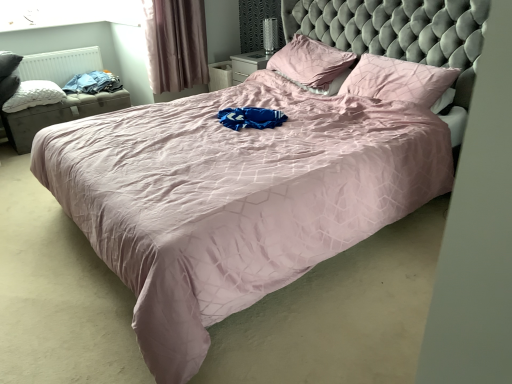
Question: From the image's perspective, is pink fabric pillow at upper right, the first pillow when ordered from right to left, beneath white quilted pillow at left, marked as the first pillow in a left-to-right arrangement?

Choices:
 (A) yes
 (B) no

Answer: (A)

Question: Is pink fabric pillow at upper right, the first pillow when ordered from right to left, aimed at white quilted pillow at left, marked as the first pillow in a left-to-right arrangement?

Choices:
 (A) yes
 (B) no

Answer: (B)

Question: Does pink fabric pillow at upper right, the first pillow when ordered from right to left, appear on the right side of white quilted pillow at left, marked as the first pillow in a left-to-right arrangement?

Choices:
 (A) yes
 (B) no

Answer: (A)

Question: Can you confirm if pink fabric pillow at upper right, which is counted as the third pillow, starting from the left, is shorter than white quilted pillow at left, marked as the first pillow in a left-to-right arrangement?

Choices:
 (A) yes
 (B) no

Answer: (B)

Question: Would you say pink fabric pillow at upper right, the first pillow when ordered from right to left, is outside white quilted pillow at left, marked as the first pillow in a left-to-right arrangement?

Choices:
 (A) yes
 (B) no

Answer: (A)

Question: Is pink fabric pillow at upper right, which is counted as the third pillow, starting from the left, in front of white quilted pillow at left, marked as the first pillow in a left-to-right arrangement?

Choices:
 (A) no
 (B) yes

Answer: (B)

Question: Is the surface of white quilted pillow at left, the 3th pillow when ordered from right to left, in direct contact with pink fabric curtain at upper left?

Choices:
 (A) yes
 (B) no

Answer: (B)

Question: From the image's perspective, does white quilted pillow at left, the 3th pillow when ordered from right to left, appear higher than pink fabric curtain at upper left?

Choices:
 (A) no
 (B) yes

Answer: (A)

Question: Can we say white quilted pillow at left, the 3th pillow when ordered from right to left, lies outside pink fabric curtain at upper left?

Choices:
 (A) no
 (B) yes

Answer: (B)

Question: Is white quilted pillow at left, the 3th pillow when ordered from right to left, not close to pink fabric curtain at upper left?

Choices:
 (A) yes
 (B) no

Answer: (A)

Question: From a real-world perspective, is white quilted pillow at left, marked as the first pillow in a left-to-right arrangement, beneath pink fabric curtain at upper left?

Choices:
 (A) no
 (B) yes

Answer: (B)

Question: From a real-world perspective, is white quilted pillow at left, marked as the first pillow in a left-to-right arrangement, located higher than pink fabric curtain at upper left?

Choices:
 (A) no
 (B) yes

Answer: (A)

Question: Are pink fabric curtain at upper left and blue cotton shirt at left making contact?

Choices:
 (A) yes
 (B) no

Answer: (B)